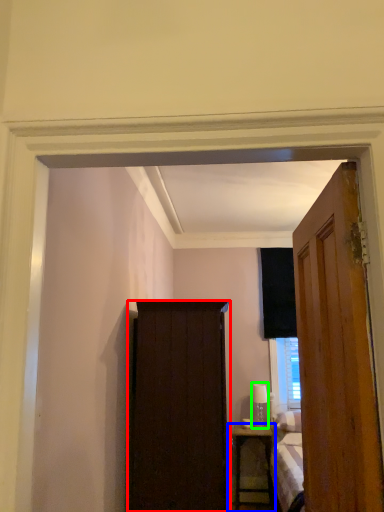
Question: Considering the real-world distances, which object is closest to screen door (highlighted by a red box)? nightstand (highlighted by a blue box) or lamp (highlighted by a green box).

Choices:
 (A) nightstand
 (B) lamp

Answer: (A)